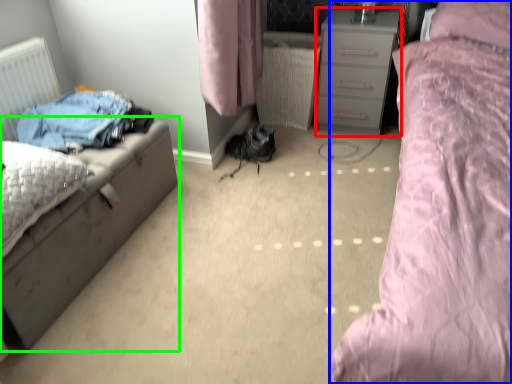
Question: Which is nearer to the chest of drawers (highlighted by a red box)? bed (highlighted by a blue box) or nightstand (highlighted by a green box).

Choices:
 (A) bed
 (B) nightstand

Answer: (A)